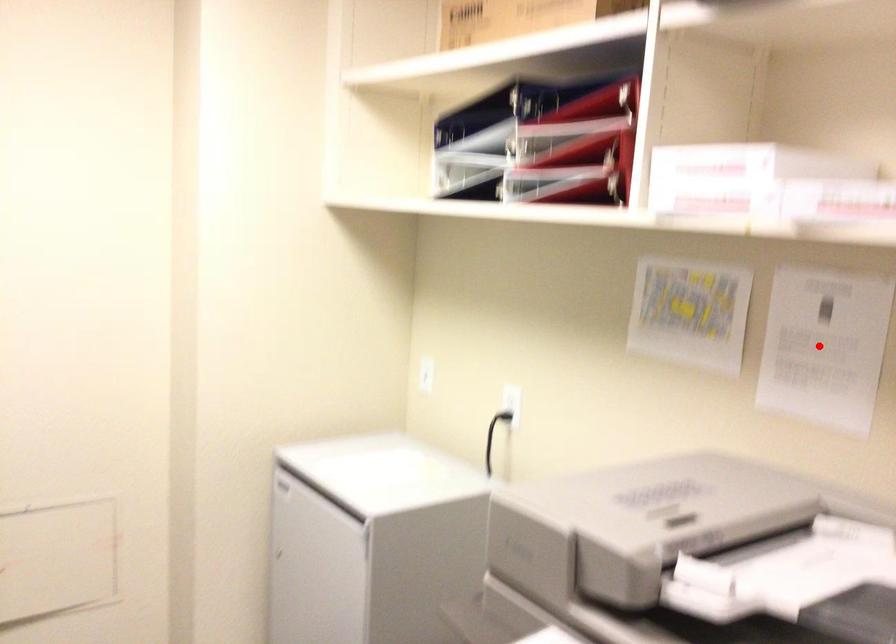
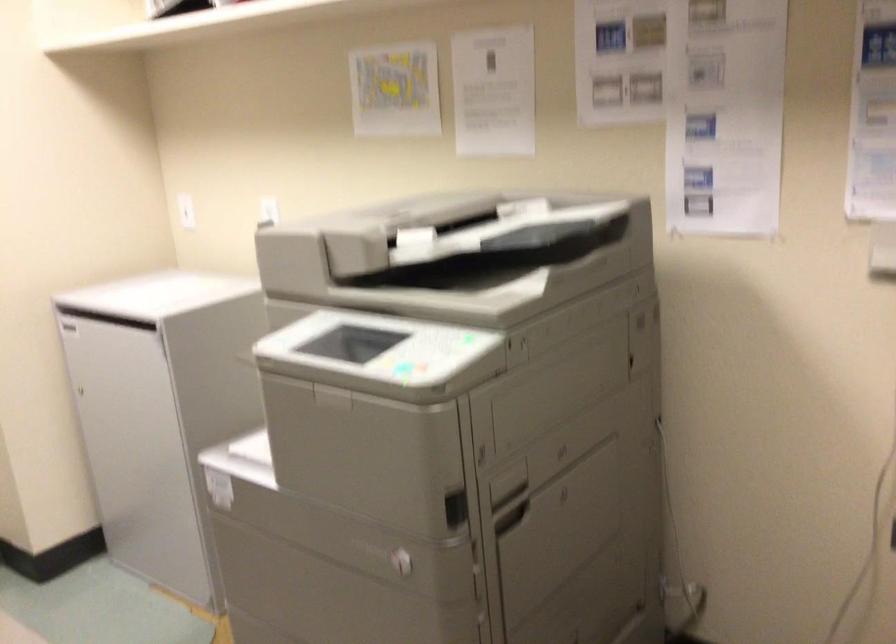
Question: I am providing you with two images of the same scene from different viewpoints. Image1 has a red point marked. In image2, the corresponding 3D location appears at what relative position? Reply with the corresponding letter.

Choices:
 (A) Closer
 (B) Farther

Answer: (B)